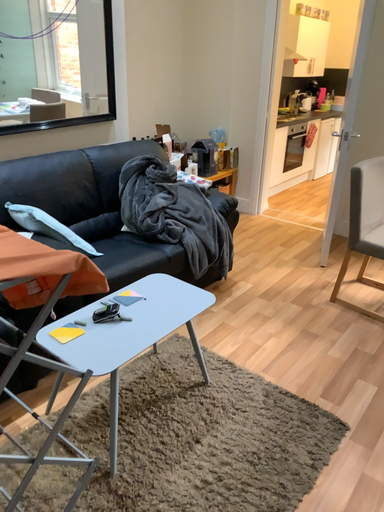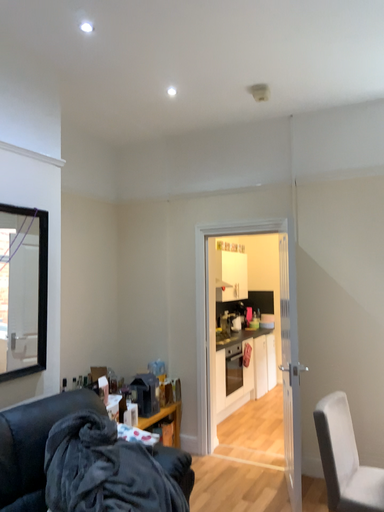
Question: Which way did the camera rotate in the video?

Choices:
 (A) rotated left
 (B) rotated right

Answer: (B)